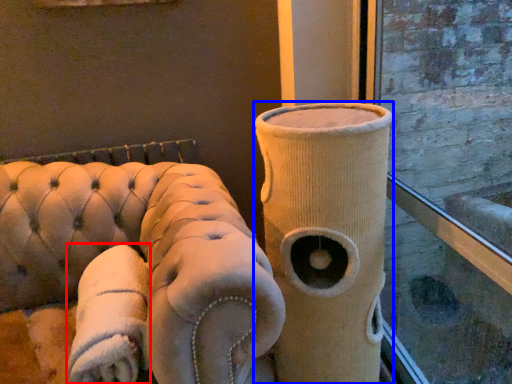
Question: Which object is closer to the camera taking this photo, cloth (highlighted by a red box) or vase (highlighted by a blue box)?

Choices:
 (A) cloth
 (B) vase

Answer: (A)